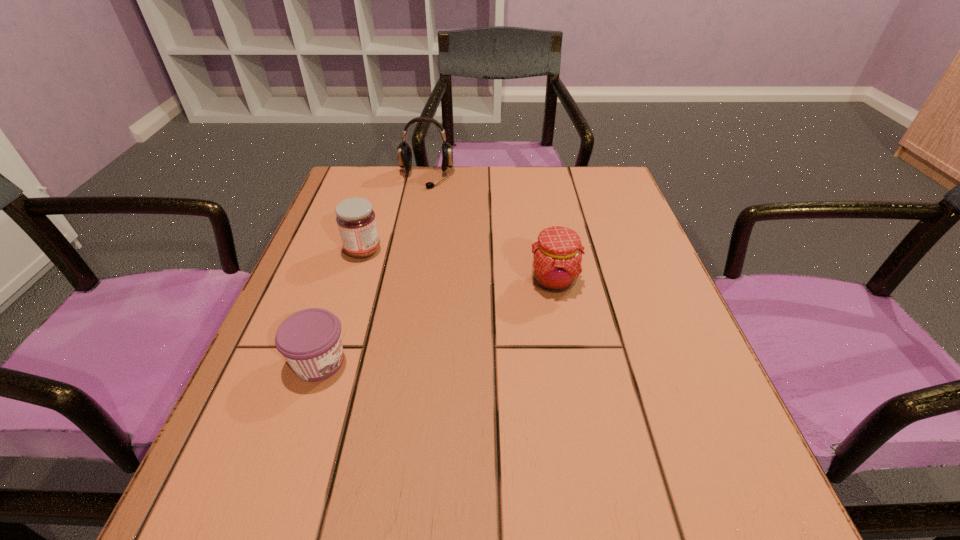
In order to click on free space between the second farthest object and the shortest jam in this screenshot , I will do `click(341, 306)`.

Identify which object is the second nearest to the third farthest object. Please provide its 2D coordinates. Your answer should be formatted as a tuple, i.e. [(x, y)], where the tuple contains the x and y coordinates of a point satisfying the conditions above.

[(310, 340)]

Locate which object is the second closest to the rightmost object. Please provide its 2D coordinates. Your answer should be formatted as a tuple, i.e. [(x, y)], where the tuple contains the x and y coordinates of a point satisfying the conditions above.

[(310, 340)]

In order to click on jam that is the closest to the second nearest jam in this screenshot , I will do `click(356, 220)`.

Identify the location of the closest jam relative to the farthest jam. The width and height of the screenshot is (960, 540). (310, 340).

Where is `vacant region that satisfies the following two spatial constraints: 1. with the microphone on the side of the headset; 2. on the left side of the second nearest object`? The image size is (960, 540). vacant region that satisfies the following two spatial constraints: 1. with the microphone on the side of the headset; 2. on the left side of the second nearest object is located at coordinates (408, 281).

Where is `vacant space that satisfies the following two spatial constraints: 1. with the microphone on the side of the tallest object; 2. on the front label of the shortest jam`? This screenshot has width=960, height=540. vacant space that satisfies the following two spatial constraints: 1. with the microphone on the side of the tallest object; 2. on the front label of the shortest jam is located at coordinates (394, 362).

Where is `free location that satisfies the following two spatial constraints: 1. with the microphone on the side of the farthest object; 2. on the front label of the shortest jam`? free location that satisfies the following two spatial constraints: 1. with the microphone on the side of the farthest object; 2. on the front label of the shortest jam is located at coordinates (394, 362).

The width and height of the screenshot is (960, 540). I want to click on free location that satisfies the following two spatial constraints: 1. with the microphone on the side of the farthest object; 2. on the front label of the shortest object, so click(x=394, y=362).

Identify the location of free point that satisfies the following two spatial constraints: 1. with the microphone on the side of the tallest object; 2. on the front label of the shortest object. This screenshot has height=540, width=960. (394, 362).